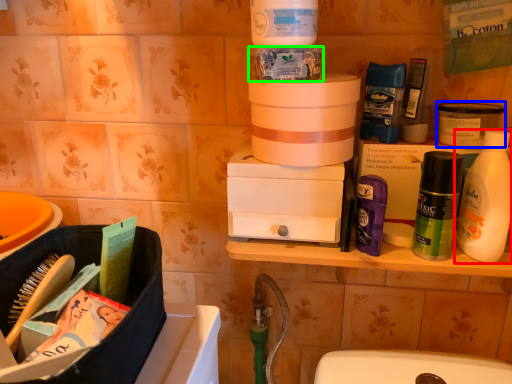
Question: Based on their relative distances, which object is nearer to bottle (highlighted by a red box)? Choose from product (highlighted by a blue box) and product (highlighted by a green box).

Choices:
 (A) product
 (B) product

Answer: (A)